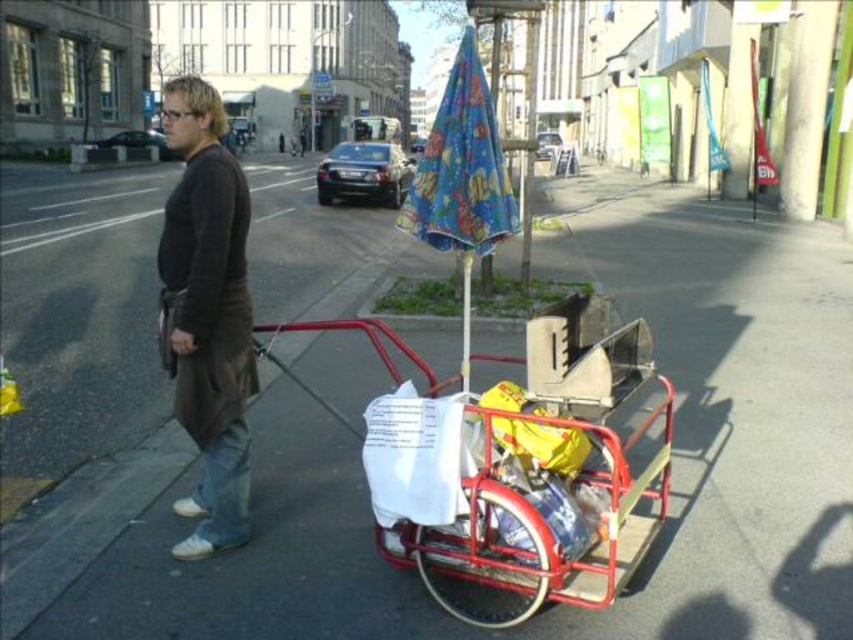
Question: Is metallic red trolley at center above brown matte jacket at left?

Choices:
 (A) yes
 (B) no

Answer: (B)

Question: Which point is farther from the camera taking this photo?

Choices:
 (A) (193, 296)
 (B) (556, 538)
 (C) (468, 108)

Answer: (C)

Question: Considering the real-world distances, which object is closest to the blue printed fabric umbrella at center?

Choices:
 (A) brown matte jacket at left
 (B) metallic red trolley at center

Answer: (B)

Question: Is metallic red trolley at center positioned at the back of brown matte jacket at left?

Choices:
 (A) yes
 (B) no

Answer: (B)

Question: Which of the following is the closest to the observer?

Choices:
 (A) metallic red trolley at center
 (B) brown matte jacket at left

Answer: (A)

Question: Does metallic red trolley at center have a smaller size compared to blue printed fabric umbrella at center?

Choices:
 (A) yes
 (B) no

Answer: (A)